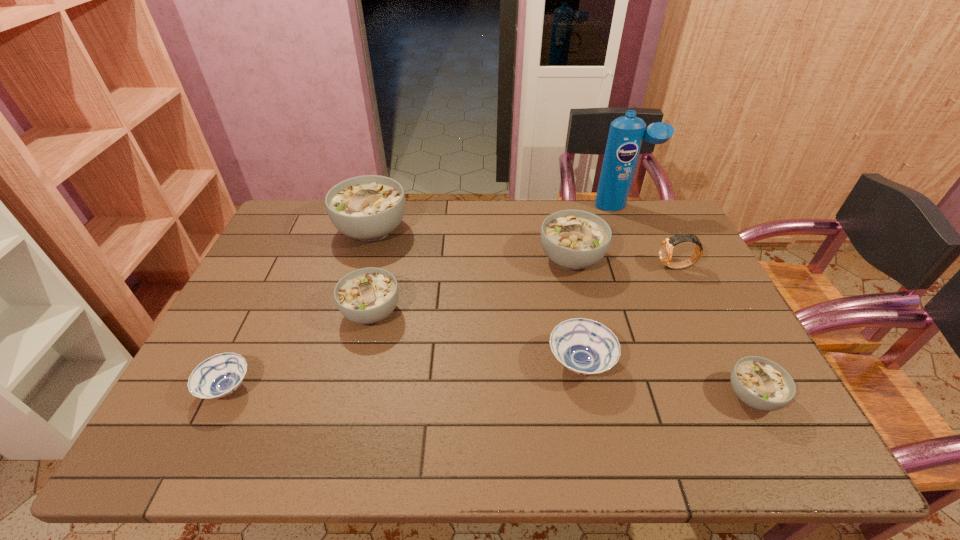
Locate which white soup bowl is the closest to the biggest white soup bowl. Please provide its 2D coordinates. Your answer should be formatted as a tuple, i.e. [(x, y)], where the tuple contains the x and y coordinates of a point satisfying the conditions above.

[(368, 295)]

Identify the location of white soup bowl identified as the fourth closest to the watch. This screenshot has width=960, height=540. (367, 208).

Find the location of a particular element. Image resolution: width=960 pixels, height=540 pixels. free location that satisfies the following two spatial constraints: 1. on the back side of the smaller blue soup bowl; 2. on the left side of the fifth shortest soup bowl is located at coordinates (290, 259).

This screenshot has width=960, height=540. Identify the location of vacant region that satisfies the following two spatial constraints: 1. on the front side of the biggest white soup bowl; 2. on the left side of the right blue soup bowl. (332, 363).